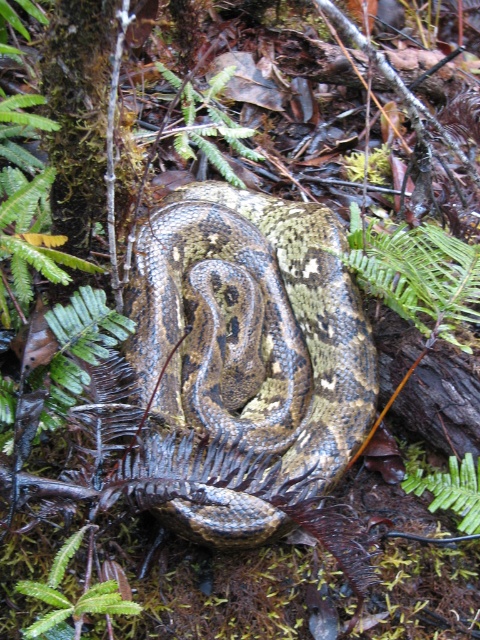
Between green leafy fern at center and green fuzzy fern at lower left, which one appears on the right side from the viewer's perspective?

Positioned to the right is green leafy fern at center.

Who is taller, green leafy fern at center or green fuzzy fern at lower left?

With more height is green leafy fern at center.

Who is more distant from viewer, (x=450, y=256) or (x=32, y=584)?

The point (x=450, y=256) is more distant.

Locate an element on the screen. This screenshot has width=480, height=640. green leafy fern at center is located at coordinates (418, 275).

Can you confirm if green leafy fern at upper center is wider than green leafy fern at lower right?

Indeed, green leafy fern at upper center has a greater width compared to green leafy fern at lower right.

From the picture: Who is positioned more to the right, green leafy fern at upper center or green leafy fern at lower right?

green leafy fern at lower right

In the scene shown: Who is more distant from viewer, (211, 150) or (450, 468)?

The point (211, 150) is more distant.

The image size is (480, 640). In order to click on green leafy fern at upper center in this screenshot , I will do `click(212, 128)`.

Who is lower down, camouflage-patterned snake at center or green fuzzy fern at lower left?

Positioned lower is green fuzzy fern at lower left.

Can you confirm if camouflage-patterned snake at center is positioned to the right of green fuzzy fern at lower left?

Indeed, camouflage-patterned snake at center is positioned on the right side of green fuzzy fern at lower left.

Where is `camouflage-patterned snake at center`? camouflage-patterned snake at center is located at coordinates (252, 326).

Find the location of `camouflage-patterned snake at center`. camouflage-patterned snake at center is located at coordinates (252, 326).